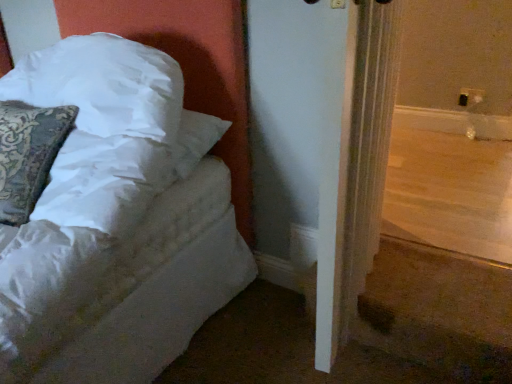
The width and height of the screenshot is (512, 384). Describe the element at coordinates (470, 97) in the screenshot. I see `black plastic electric outlet at upper right` at that location.

You are a GUI agent. You are given a task and a screenshot of the screen. Output one action in this format:
    pyautogui.click(x=<x>, y=<y>)
    Task: Click on the black plastic electric outlet at upper right
    This screenshot has height=384, width=512.
    Given the screenshot: What is the action you would take?
    pyautogui.click(x=470, y=97)

What are the coordinates of `black plastic electric outlet at upper right` in the screenshot? It's located at (470, 97).